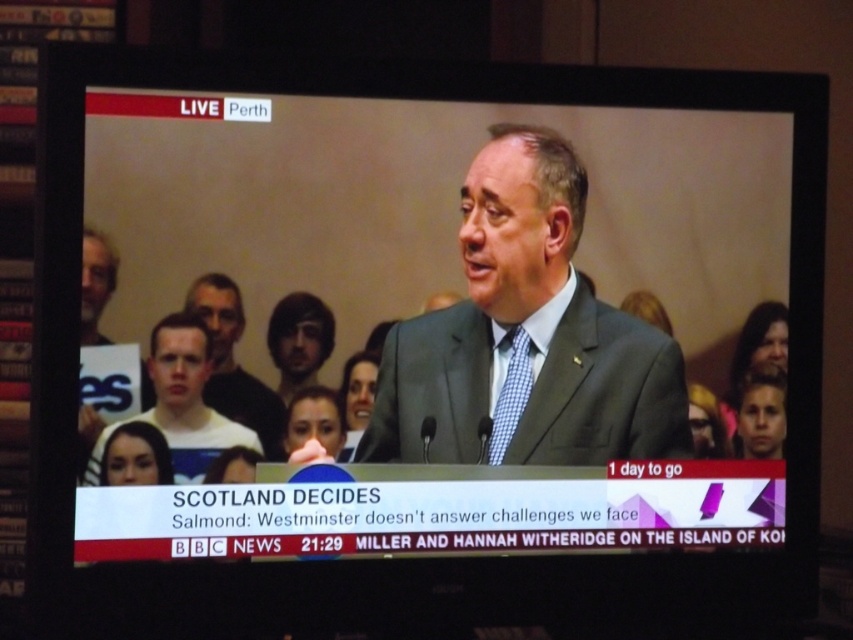
You are a camera operator adjusting the zoom to focus on the speaker. The light brown hair at center and checkered fabric tie at center are currently in your view. If your camera has a minimum focus distance of 12 inches, can you focus on both objects without moving the camera?

The distance between the light brown hair at center and the checkered fabric tie at center is 12.80 inches. Since this distance is greater than the camera minimum focus distance of 12 inches, the camera can focus on both objects without moving.